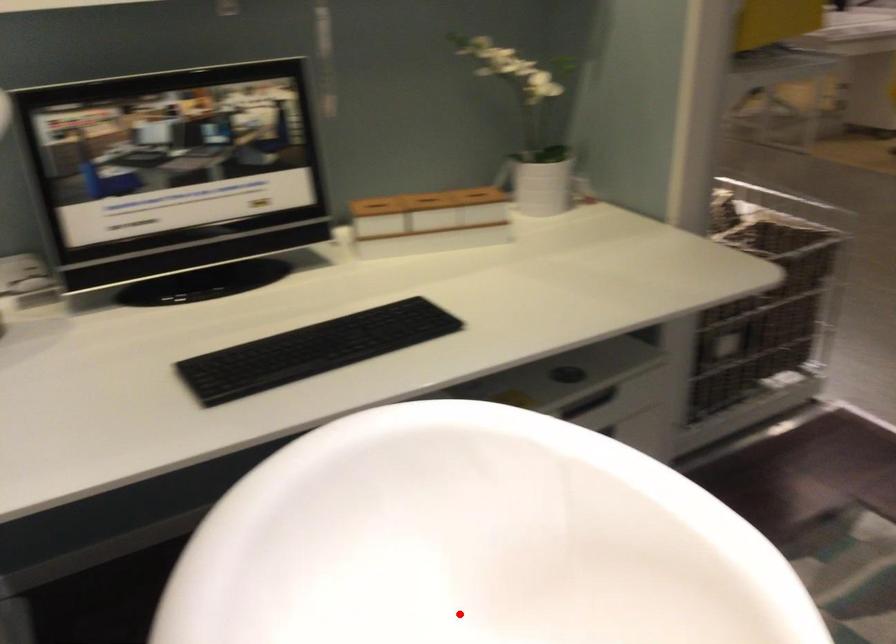
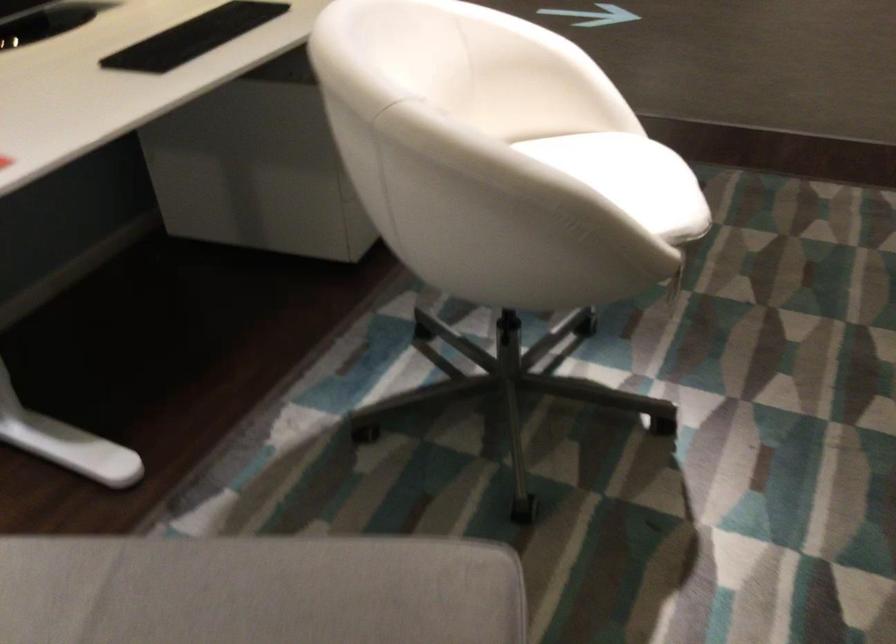
Question: I am providing you with two images of the same scene from different viewpoints. A red point is marked on the first image. Can you still see the location of the red point in image 2?

Choices:
 (A) Yes
 (B) No

Answer: (B)